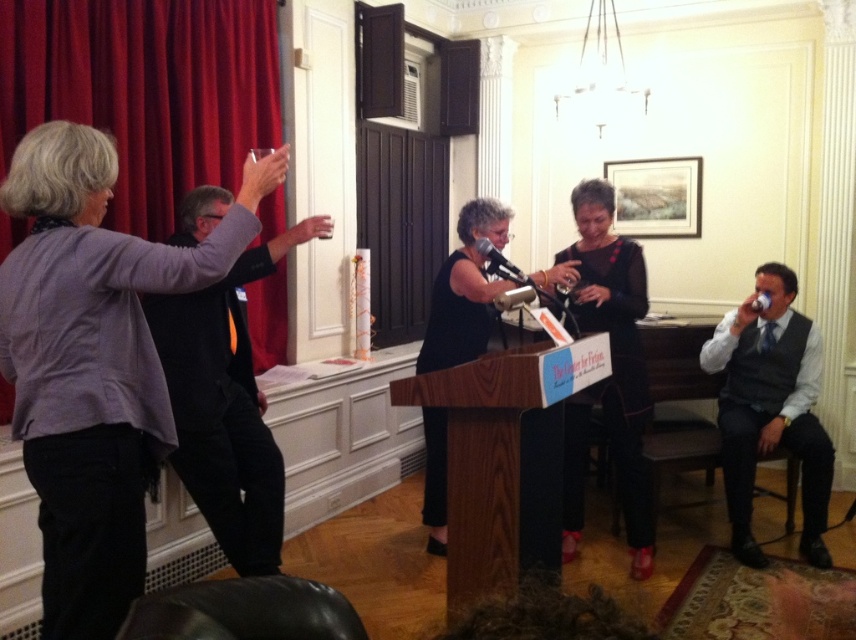
Question: Does matte gray blouse at upper left have a smaller size compared to metallic silver microphone at center?

Choices:
 (A) yes
 (B) no

Answer: (B)

Question: Among these objects, which one is nearest to the camera?

Choices:
 (A) black velvet dress at center
 (B) red velvet curtain at left
 (C) matte gray blouse at upper left
 (D) gray wool vest at right

Answer: (C)

Question: Among these points, which one is nearest to the camera?

Choices:
 (A) (479, 246)
 (B) (186, 259)

Answer: (B)

Question: Is gray wool vest at right below black matte microphone at center?

Choices:
 (A) yes
 (B) no

Answer: (A)

Question: Is red velvet curtain at left thinner than gray wool vest at right?

Choices:
 (A) no
 (B) yes

Answer: (A)

Question: Estimate the real-world distances between objects in this image. Which object is farther from the black velvet dress at center?

Choices:
 (A) black matte microphone at center
 (B) red velvet curtain at left
 (C) dark gray sweater at left
 (D) black matte dress at center

Answer: (B)